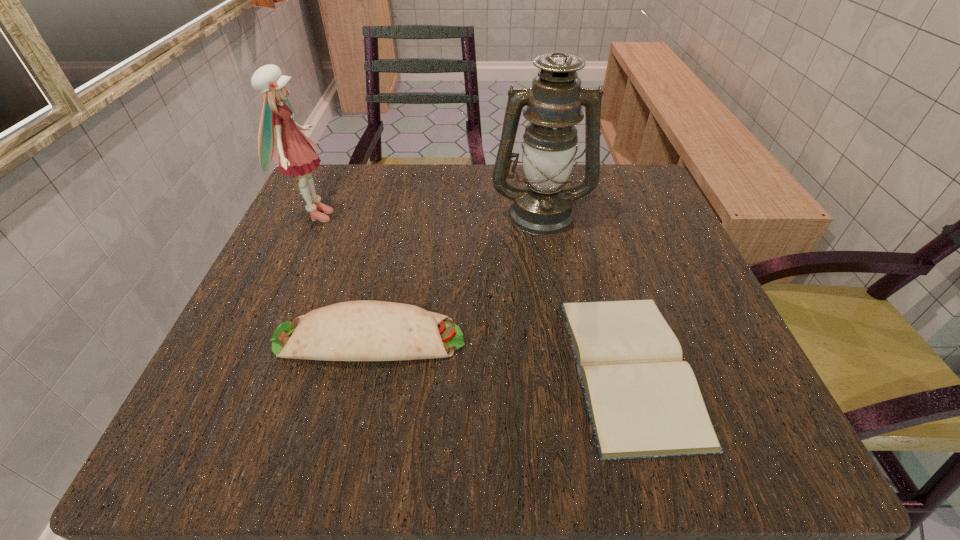
At what (x,y) coordinates should I click in order to perform the action: click on vacant space at the right edge of the desktop. Please return your answer as a coordinate pair (x, y). Looking at the image, I should click on (635, 231).

In the image, there is a desktop. At what (x,y) coordinates should I click in order to perform the action: click on vacant space at the far left corner. Please return your answer as a coordinate pair (x, y). Looking at the image, I should click on (318, 181).

Locate an element on the screen. Image resolution: width=960 pixels, height=540 pixels. free space at the near left corner of the desktop is located at coordinates (231, 428).

The image size is (960, 540). In order to click on free location at the far right corner in this screenshot , I will do `click(607, 222)`.

Identify the location of vacant region at the near right corner of the desktop. point(773,451).

The height and width of the screenshot is (540, 960). What are the coordinates of `free space between the doll and the burrito` in the screenshot? It's located at (342, 277).

I want to click on free spot between the doll and the oil lamp, so click(x=428, y=214).

In order to click on empty space between the oil lamp and the doll in this screenshot , I will do `click(428, 214)`.

Find the location of a particular element. vacant area between the second shortest object and the doll is located at coordinates (342, 277).

The height and width of the screenshot is (540, 960). Identify the location of vacant region between the oil lamp and the burrito. point(455,276).